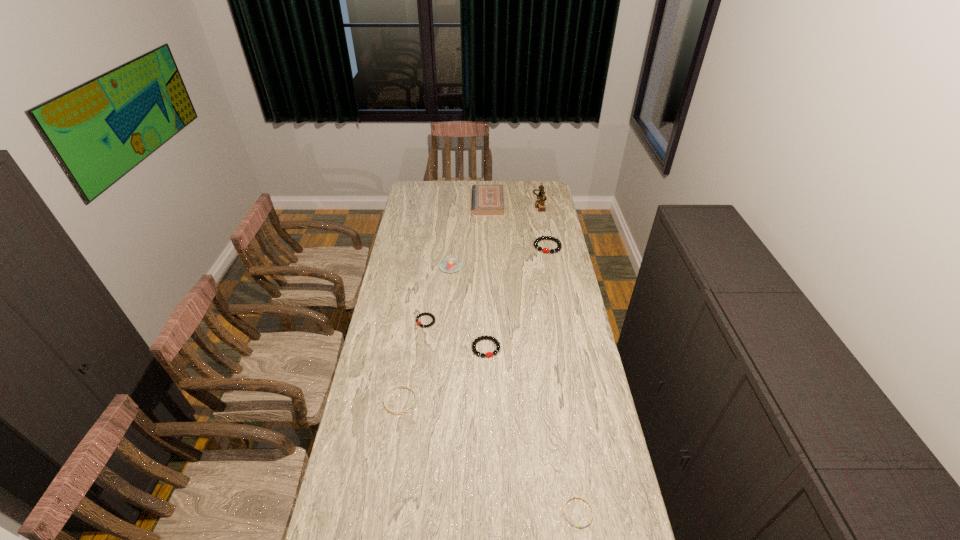
Find the location of a particular element. The width and height of the screenshot is (960, 540). brown telephone is located at coordinates (540, 204).

The height and width of the screenshot is (540, 960). I want to click on telephone, so click(x=540, y=204).

Where is `the seventh shortest object`? Image resolution: width=960 pixels, height=540 pixels. the seventh shortest object is located at coordinates (487, 199).

Where is `blue Bible`? The width and height of the screenshot is (960, 540). blue Bible is located at coordinates (487, 199).

Find the location of a particular element. The width and height of the screenshot is (960, 540). the third tallest object is located at coordinates (449, 265).

Where is `the fifth nearest object`? the fifth nearest object is located at coordinates (449, 265).

I want to click on the fifth shortest object, so click(545, 250).

Locate an element on the screen. The image size is (960, 540). the rightmost black bracelet is located at coordinates (545, 250).

Where is `the nearest black bracelet`? The image size is (960, 540). the nearest black bracelet is located at coordinates (489, 354).

This screenshot has width=960, height=540. I want to click on the third nearest bracelet, so click(489, 354).